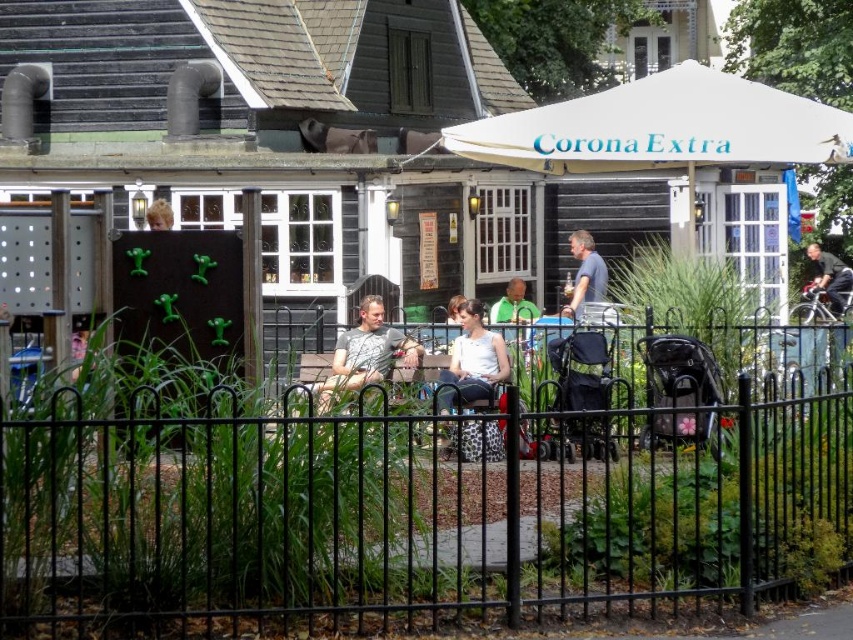
Question: Does black metal fence at center appear over dark blue shirt at upper right?

Choices:
 (A) no
 (B) yes

Answer: (A)

Question: Based on their relative distances, which object is nearer to the gray fabric shirt at center?

Choices:
 (A) black metal fence at center
 (B) light gray fabric shirt at center
 (C) dark blue shirt at upper right

Answer: (B)

Question: Which object is the closest to the dark blue shirt at upper right?

Choices:
 (A) green matte shirt at center
 (B) white matte tank top at center

Answer: (A)

Question: Among these objects, which one is farthest from the camera?

Choices:
 (A) gray fabric shirt at center
 (B) black metal fence at center
 (C) white matte tank top at center
 (D) blonde hair at center

Answer: (A)

Question: Is black metal fence at center smaller than dark blue shirt at upper right?

Choices:
 (A) yes
 (B) no

Answer: (A)

Question: Does gray fabric shirt at center appear on the right side of blonde hair at center?

Choices:
 (A) yes
 (B) no

Answer: (A)